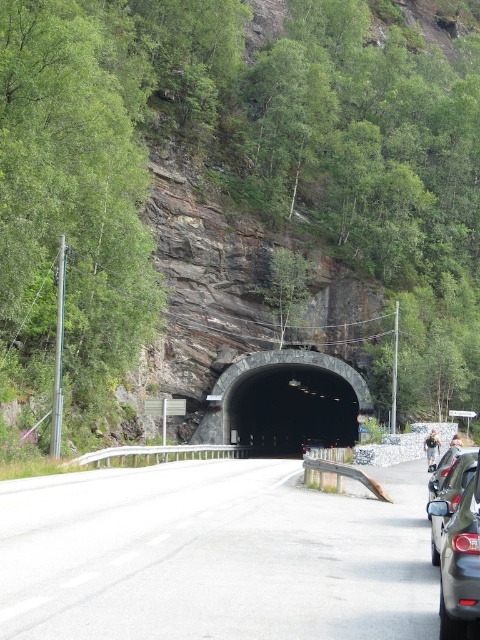
You are driving a truck that is 4 meters tall. You see the dark gray concrete tunnel at center and the matte black car at right. Can your truck pass through the tunnel without hitting the top?

The dark gray concrete tunnel at center is taller than the matte black car at right. Since the truck is 4 meters tall, the tunnel must be taller than 4 meters to allow passage. However, the description only states the tunnel is taller than the car, but doesn not provide the car height. Therefore, it is uncertain if the truck can pass safely.

You are driving a truck that is 3 meters wide. You need to enter the tunnel through the gray asphalt road at center. There is a matte black car at right parked on the side. Can your truck safely pass through the tunnel entrance without hitting the parked car?

The gray asphalt road at center might be wider than matte black car at right, so it is possible that the truck can safely pass through the tunnel entrance without hitting the parked car, but there is uncertainty due to the comparison being uncertain.

You are driving a car that is 1.8 meters wide and need to enter the tunnel. The tunnel entrance is narrow. Considering the parked cars on the right side of the road, which car, the matte black car at right or the metallic silver car at right, has a width that would allow your car to pass safely through the tunnel entrance?

The matte black car at right has a lesser width compared to metallic silver car at right. Since your car is 1.8 meters wide, the matte black car at right, being narrower, would allow your car to pass safely through the tunnel entrance.